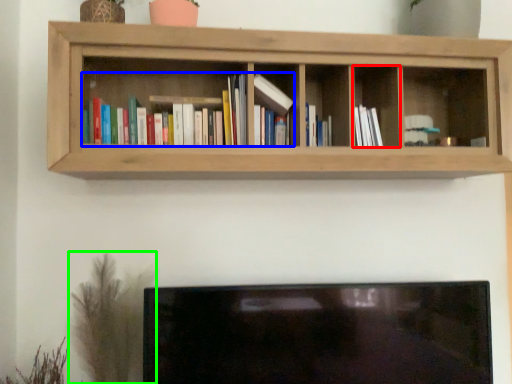
Question: Based on their relative distances, which object is farther from cabinet (highlighted by a red box)? Choose from book (highlighted by a blue box) and plant (highlighted by a green box).

Choices:
 (A) book
 (B) plant

Answer: (B)